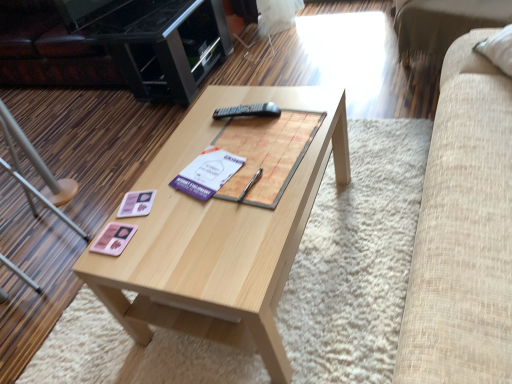
At what (x,y) coordinates should I click in order to perform the action: click on free space above white paper at center (from a real-world perspective). Please return your answer as a coordinate pair (x, y). Looking at the image, I should click on (203, 172).